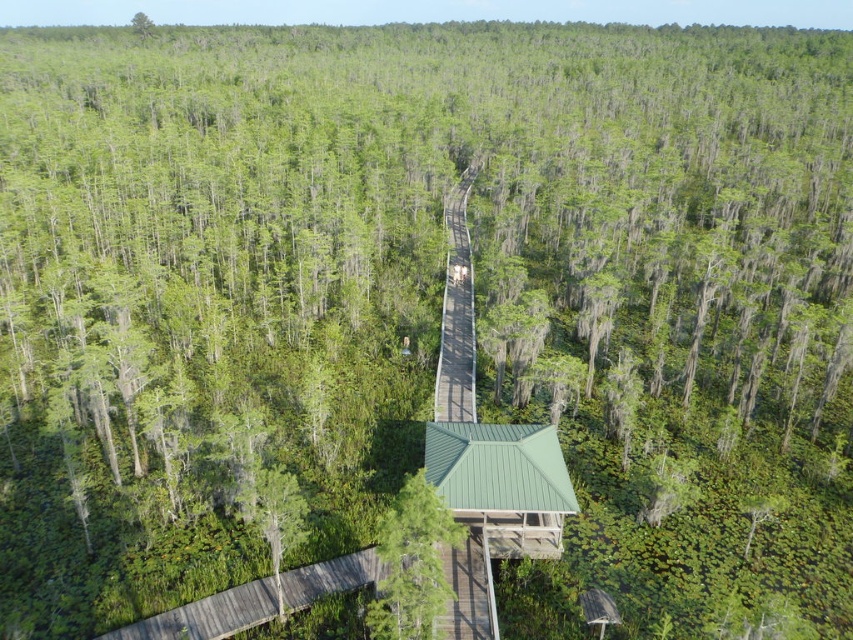
You are a park ranger planning to install a new sign at the green matte tree at center. The sign requires a support pole that must be shorter than the width of the tree. Can you use the support pole designed for the smooth gray wooden bridge at bottom left, which is 1.5 meters wide?

The green matte tree at center has a lesser width compared to the smooth gray wooden bridge at bottom left. Since the bridge is wider, the support pole designed for it is 1.5 meters, which is wider than the tree. Therefore, the pole is too wide for the tree and cannot be used.

You are a park ranger planning to install a new sign at the center of the green matte tree at center and brown wooden boardwalk at center. Which object should the sign be placed closer to, the taller one or the shorter one?

The brown wooden boardwalk at center is taller than the green matte tree at center. Therefore, the sign should be placed closer to the brown wooden boardwalk at center.

You are planning to walk along the brown wooden boardwalk at center. Is there a green matte tree at lower left that you might step over or around?

The brown wooden boardwalk at center is positioned over the green matte tree at lower left, so you would step over it.